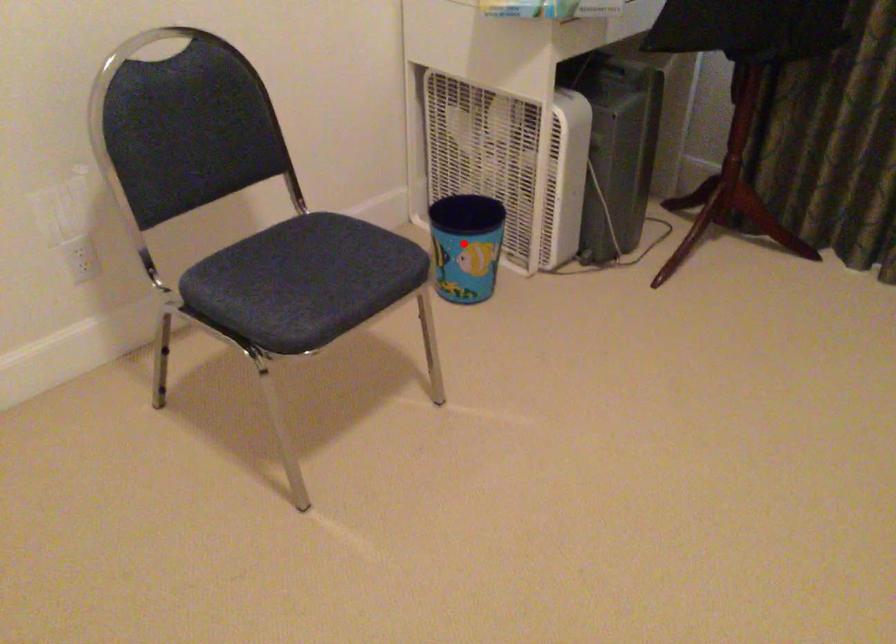
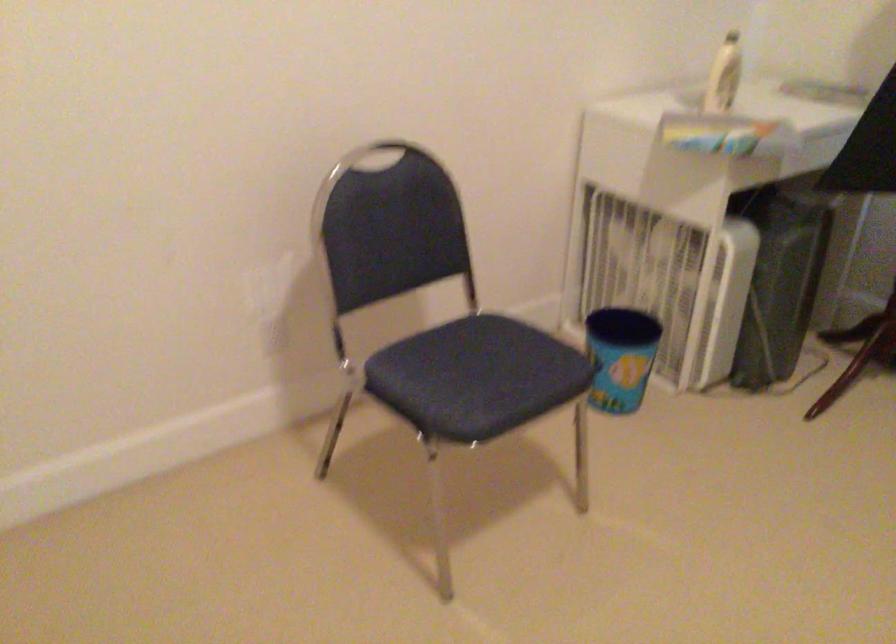
Question: I am providing you with two images of the same scene from different viewpoints. A red point is marked on the first image. Is the red point's position out of view in image 2?

Choices:
 (A) Yes
 (B) No

Answer: (B)